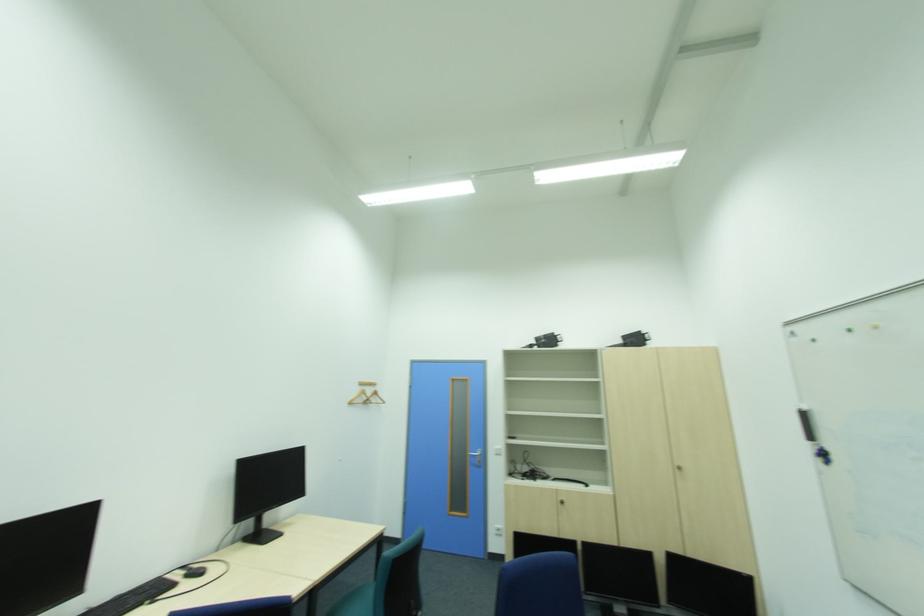
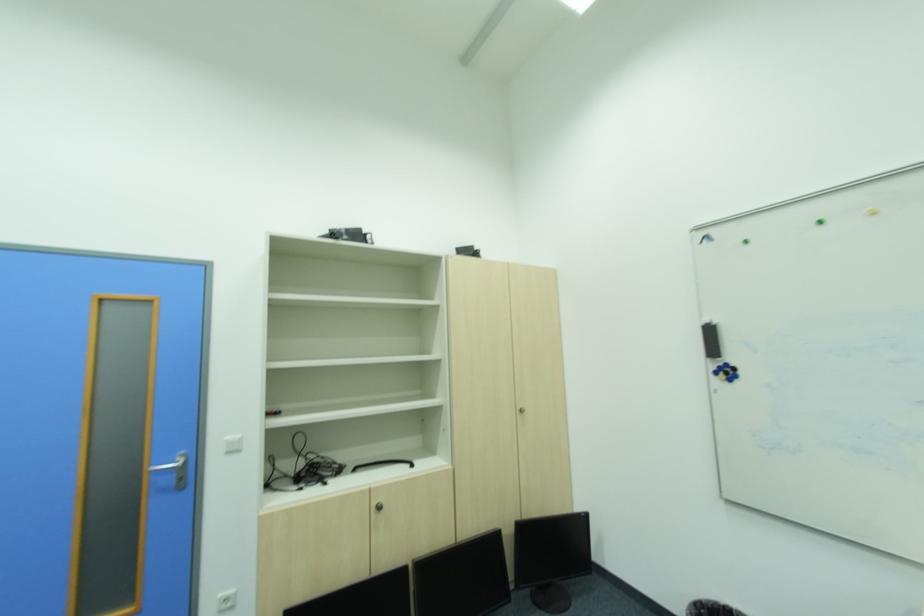
The point at (505,531) is marked in the first image. Where is the corresponding point in the second image?

(234, 602)